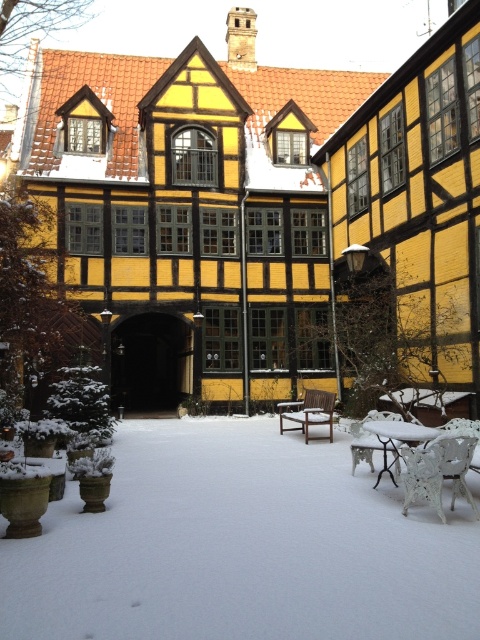
Is point (404, 504) closer to camera compared to point (289, 417)?

That is True.

Image resolution: width=480 pixels, height=640 pixels. Describe the element at coordinates (437, 472) in the screenshot. I see `white plastic chair at lower right` at that location.

Is point (462, 468) less distant than point (320, 412)?

Yes, it is.

Locate an element on the screen. The image size is (480, 640). white plastic chair at lower right is located at coordinates (437, 472).

Who is positioned more to the left, white powdery snow at lower left or white plastic chair at lower right?

Positioned to the left is white powdery snow at lower left.

Which of these two, white powdery snow at lower left or white plastic chair at lower right, stands taller?

Standing taller between the two is white plastic chair at lower right.

Describe the element at coordinates (240, 547) in the screenshot. The height and width of the screenshot is (640, 480). I see `white powdery snow at lower left` at that location.

Where is `white powdery snow at lower left`? white powdery snow at lower left is located at coordinates (240, 547).

Is brown wooden chair at center closer to camera compared to metallic silver chair at lower right?

Result: No.

Does brown wooden chair at center have a greater height compared to metallic silver chair at lower right?

In fact, brown wooden chair at center may be shorter than metallic silver chair at lower right.

Identify the location of brown wooden chair at center. (309, 412).

In order to click on brown wooden chair at center in this screenshot , I will do (309, 412).